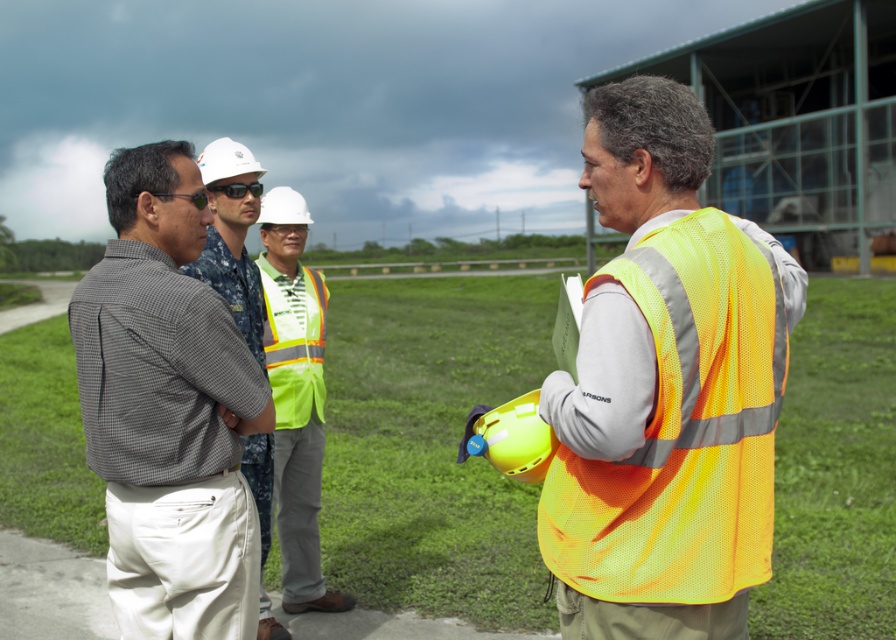
From the picture: You are a safety inspector standing at the edge of the grassy area. You notice two workers at the center of the image wearing a reflective yellow safety vest and a matte gray shirt. According to safety regulations, workers must maintain a minimum distance of 24 inches between each other for safety. Is the distance between the reflective yellow safety vest at center and the matte gray shirt at center compliant with this requirement?

The reflective yellow safety vest at center is 20.97 inches from the matte gray shirt at center. Since 20.97 inches is less than the required 24 inches, the distance does not comply with the safety regulation.

You are a construction worker standing on the paved path and want to hand a tool to both the reflective yellow safety vest at center and the matte gray shirt at center. Which person should you approach first to ensure you can reach them without moving closer?

You should approach the reflective yellow safety vest at center first because it is closer to you than the matte gray shirt at center, so you can reach them without needing to move closer.

You are a safety inspector at the construction site and need to ensure that the neon yellow safety vest at center and the reflective yellow safety vest at center comply with size regulations. According to the safety guidelines, the minimum width for safety vests is 30 cm. Can you determine if both safety vests meet the requirement?

The neon yellow safety vest at center has a width surpassing the reflective yellow safety vest at center. Since the minimum required width is 30 cm, and the neon yellow one is wider, it likely meets the requirement. However, without knowing the exact width of the reflective one, we cannot confirm if it meets the minimum. Both need to be measured individually.